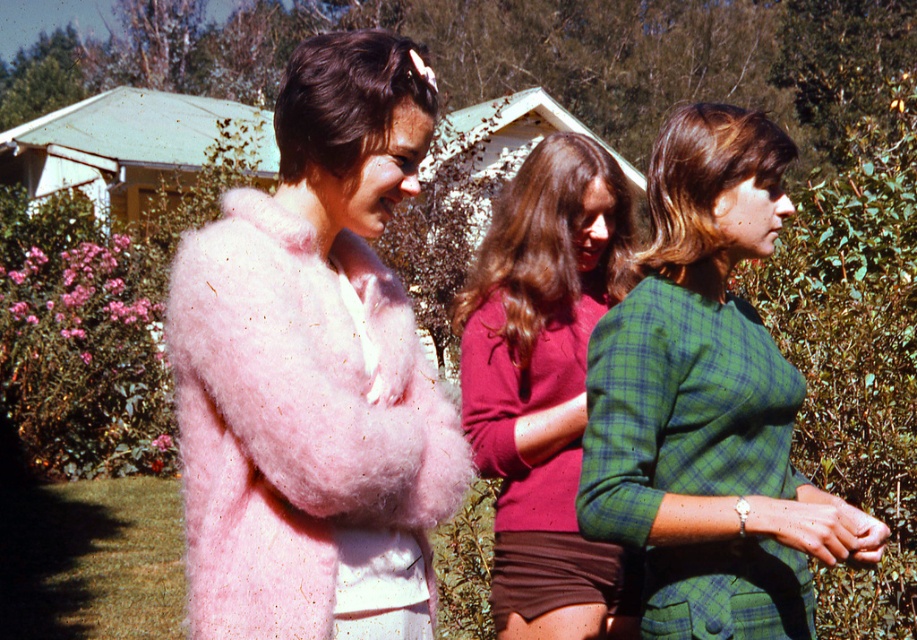
Does green plaid dress at right have a greater width compared to plaid fabric shirt at center?

Indeed, green plaid dress at right has a greater width compared to plaid fabric shirt at center.

Which of these two, green plaid dress at right or plaid fabric shirt at center, stands shorter?

green plaid dress at right is shorter.

Measure the distance between green plaid dress at right and camera.

green plaid dress at right is 6.51 feet away from camera.

Where is `green plaid dress at right`? green plaid dress at right is located at coordinates (708, 404).

Is pink fluffy coat at left bigger than plaid fabric shirt at center?

Indeed, pink fluffy coat at left has a larger size compared to plaid fabric shirt at center.

Who is higher up, pink fluffy coat at left or plaid fabric shirt at center?

Positioned higher is plaid fabric shirt at center.

Locate an element on the screen. The image size is (917, 640). pink fluffy coat at left is located at coordinates (315, 369).

Between point (327, 284) and point (743, 536), which one is positioned behind?

The point (743, 536) is more distant.

Is pink fluffy coat at left below green plaid dress at right?

Yes, pink fluffy coat at left is below green plaid dress at right.

The height and width of the screenshot is (640, 917). What do you see at coordinates (315, 369) in the screenshot?
I see `pink fluffy coat at left` at bounding box center [315, 369].

Locate an element on the screen. This screenshot has width=917, height=640. pink fluffy coat at left is located at coordinates (315, 369).